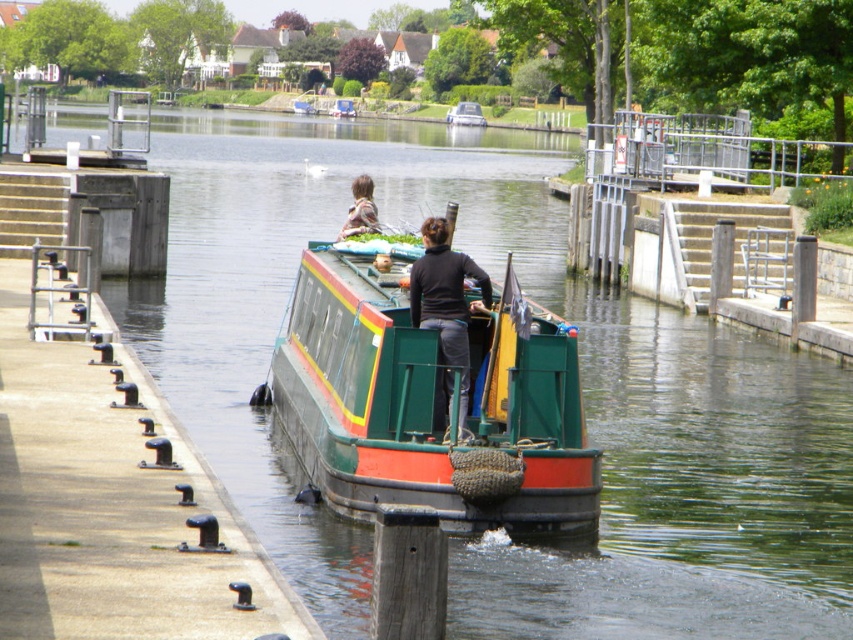
Question: Is green painted wood at left to the right of camouflage jacket at upper center from the viewer's perspective?

Choices:
 (A) yes
 (B) no

Answer: (B)

Question: Based on their relative distances, which object is farther from the green painted wooden boat at center?

Choices:
 (A) black matte jacket at center
 (B) green painted wood boat at center
 (C) green painted wood at left
 (D) camouflage jacket at upper center

Answer: (A)

Question: Is green painted wood at left closer to the viewer compared to green painted wood boat at center?

Choices:
 (A) yes
 (B) no

Answer: (A)

Question: Which object is positioned farthest from the black matte jacket at center?

Choices:
 (A) camouflage jacket at upper center
 (B) green painted wood boat at center
 (C) green painted wooden boat at center
 (D) green painted wood at left

Answer: (C)

Question: Is green painted wood at left positioned before black matte jacket at center?

Choices:
 (A) no
 (B) yes

Answer: (B)

Question: Which point is farther from the camera taking this photo?

Choices:
 (A) [x=343, y=227]
 (B) [x=386, y=372]
 (C) [x=146, y=467]

Answer: (A)